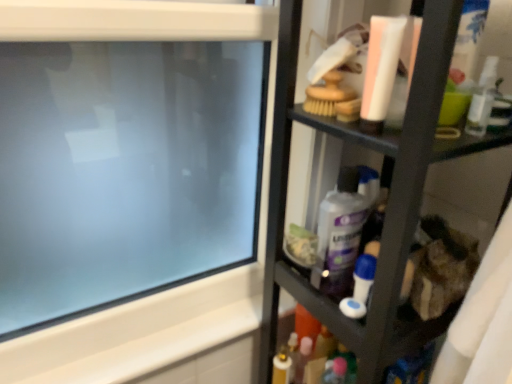
Question: Based on their positions, is transparent glass computer screen at upper left located to the left or right of black plastic shelf at right?

Choices:
 (A) right
 (B) left

Answer: (B)

Question: Is transparent glass computer screen at upper left spatially inside black plastic shelf at right, or outside of it?

Choices:
 (A) outside
 (B) inside

Answer: (A)

Question: Which object is the closest to the black plastic shelf at right?

Choices:
 (A) blue plastic toothbrush at center-right
 (B) purple glossy bottle at center
 (C) transparent glass computer screen at upper left

Answer: (B)

Question: Considering the real-world distances, which object is farthest from the blue plastic toothbrush at center-right?

Choices:
 (A) purple glossy bottle at center
 (B) black plastic shelf at right
 (C) transparent glass computer screen at upper left

Answer: (C)